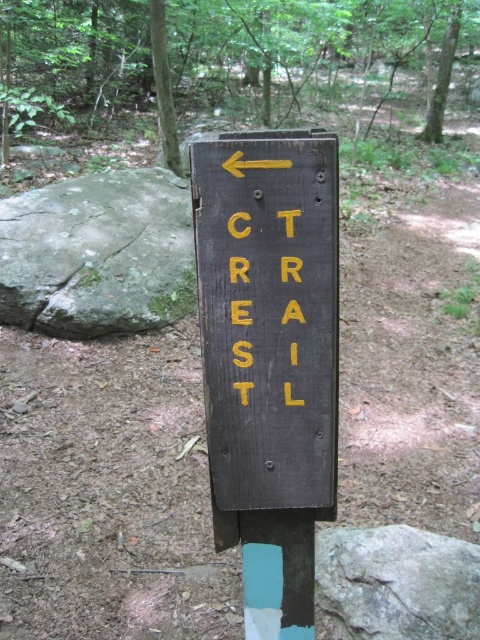
Which of these two, matte wood sign at center or green rough rock at left, stands taller?

With more height is green rough rock at left.

Can you confirm if matte wood sign at center is positioned above green rough rock at left?

No.

Which is in front, point (300, 428) or point (87, 291)?

Point (300, 428)

Locate an element on the screen. matte wood sign at center is located at coordinates (268, 316).

Consider the image. Is gray rough rock at center wider than yellow painted letters at center?

Yes, gray rough rock at center is wider than yellow painted letters at center.

Which is above, gray rough rock at center or yellow painted letters at center?

yellow painted letters at center is higher up.

Who is more distant from viewer, (355, 624) or (285, 384)?

Positioned behind is point (355, 624).

Find the location of a particular element. The height and width of the screenshot is (640, 480). gray rough rock at center is located at coordinates (397, 582).

Which is below, matte wood sign at center or yellow painted letters at center?

matte wood sign at center is lower down.

The image size is (480, 640). Describe the element at coordinates (268, 316) in the screenshot. I see `matte wood sign at center` at that location.

Does point (312, 156) come closer to viewer compared to point (245, 362)?

Yes, it is in front of point (245, 362).

You are a GUI agent. You are given a task and a screenshot of the screen. Output one action in this format:
    pyautogui.click(x=<x>, y=<y>)
    Task: Click on the matte wood sign at center
    
    Given the screenshot: What is the action you would take?
    pyautogui.click(x=268, y=316)